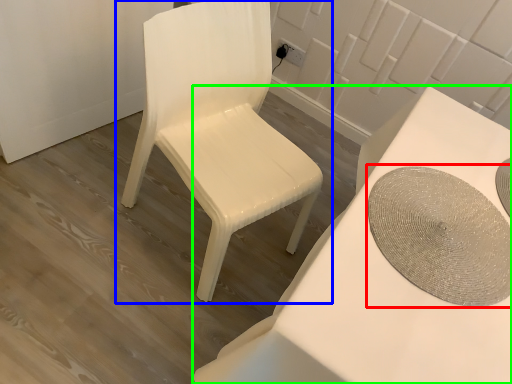
Question: Estimate the real-world distances between objects in this image. Which object is closer to round table (highlighted by a red box), chair (highlighted by a blue box) or table (highlighted by a green box)?

Choices:
 (A) chair
 (B) table

Answer: (B)